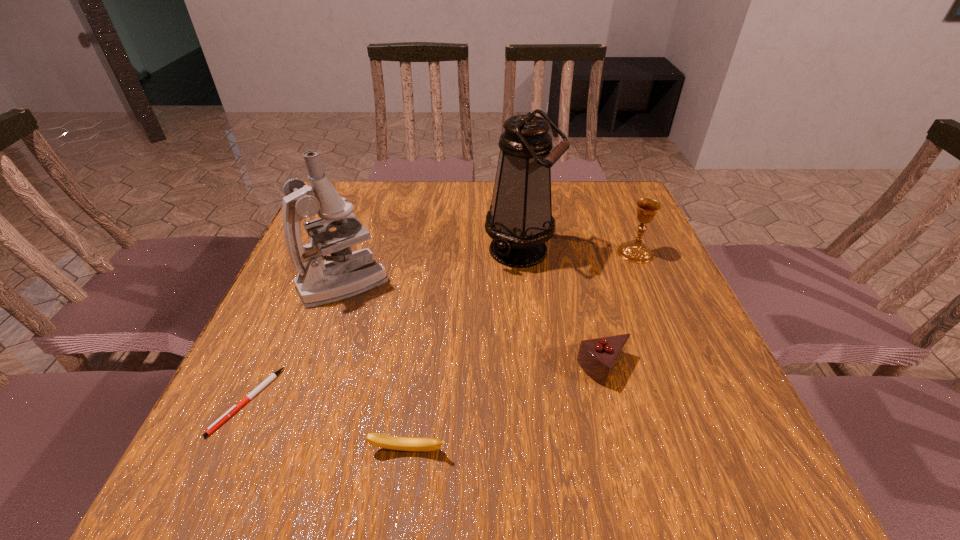
The height and width of the screenshot is (540, 960). I want to click on oil lamp, so click(520, 221).

Identify the location of microscope. (345, 273).

This screenshot has width=960, height=540. Find the location of `chalice`. chalice is located at coordinates (635, 251).

The width and height of the screenshot is (960, 540). In order to click on the rightmost object in this screenshot , I will do `click(635, 251)`.

The image size is (960, 540). Identify the location of chocolate cake. (598, 357).

Locate an element on the screen. The width and height of the screenshot is (960, 540). banana is located at coordinates (379, 440).

Where is `the third object from left to right`? the third object from left to right is located at coordinates (379, 440).

The image size is (960, 540). I want to click on the shortest object, so click(x=232, y=410).

At what (x,y) coordinates should I click in order to perform the action: click on free space located 0.220m on the right of the oil lamp. Please return your answer as a coordinate pair (x, y). The image size is (960, 540). Looking at the image, I should click on (643, 249).

You are a GUI agent. You are given a task and a screenshot of the screen. Output one action in this format:
    pyautogui.click(x=<x>, y=<y>)
    Task: Click on the vacant space located on the back of the microscope
    The width and height of the screenshot is (960, 540).
    Given the screenshot: What is the action you would take?
    pyautogui.click(x=373, y=197)